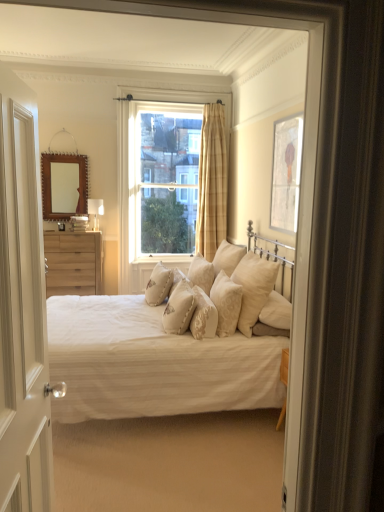
What do you see at coordinates (226, 303) in the screenshot? I see `creamy satin pillow at center, the 2th pillow positioned from the right` at bounding box center [226, 303].

Where is `clear glass window at center`? This screenshot has width=384, height=512. clear glass window at center is located at coordinates (168, 182).

Locate an element on the screen. The image size is (384, 512). wooden-framed mirror at upper left is located at coordinates (64, 185).

At what (x,y) coordinates should I click in order to perform the action: click on creamy satin pillow at center, which ranks as the fourth pillow in left-to-right order. Please return your answer as a coordinate pair (x, y). This screenshot has width=384, height=512. Looking at the image, I should click on tap(203, 316).

Is point (62, 211) closer to viewer compared to point (88, 251)?

No, it is not.

Is wooden-framed mirror at upper left turned away from natural wood chest of drawers at left?

wooden-framed mirror at upper left is not turned away from natural wood chest of drawers at left.

Who is shorter, wooden-framed mirror at upper left or natural wood chest of drawers at left?

With less height is natural wood chest of drawers at left.

Where is `mirror located behind the natural wood chest of drawers at left`? mirror located behind the natural wood chest of drawers at left is located at coordinates (64, 185).

Does wooden-framed mirror at upper left turn towards beige textured pillow at center, which is the 6th pillow from right to left?

No, wooden-framed mirror at upper left is not facing towards beige textured pillow at center, which is the 6th pillow from right to left.

Is point (52, 214) behind point (173, 270)?

That is True.

Consider the image. How distant is wooden-framed mirror at upper left from beige textured pillow at center, marked as the second pillow in a left-to-right arrangement?

The distance of wooden-framed mirror at upper left from beige textured pillow at center, marked as the second pillow in a left-to-right arrangement, is 6.78 feet.

From the image's perspective, which is above, wooden-framed mirror at upper left or beige textured pillow at center, marked as the second pillow in a left-to-right arrangement?

wooden-framed mirror at upper left.

Who is smaller, natural wood chest of drawers at left or wooden-framed mirror at upper left?

Smaller between the two is wooden-framed mirror at upper left.

Is natural wood chest of drawers at left taller or shorter than wooden-framed mirror at upper left?

natural wood chest of drawers at left is shorter than wooden-framed mirror at upper left.

From a real-world perspective, who is located higher, natural wood chest of drawers at left or wooden-framed mirror at upper left?

From a 3D spatial view, wooden-framed mirror at upper left is above.

Which of these two, creamy satin pillow at center, which is the 6th pillow from left to right, or beige textured pillow at center, which is the 6th pillow from right to left, stands shorter?

Standing shorter between the two is beige textured pillow at center, which is the 6th pillow from right to left.

Does creamy satin pillow at center, the 2th pillow positioned from the right, touch beige textured pillow at center, which is the 6th pillow from right to left?

No, creamy satin pillow at center, the 2th pillow positioned from the right, is not making contact with beige textured pillow at center, which is the 6th pillow from right to left.

Locate an element on the screen. the 4th pillow located above the beige textured pillow at center, marked as the second pillow in a left-to-right arrangement (from a real-world perspective) is located at coordinates (226, 303).

Is creamy satin pillow at center, the 2th pillow positioned from the right, positioned behind beige textured pillow at center, which is the 6th pillow from right to left?

That is False.

From a real-world perspective, is matte white bed at center above or below matte silver picture frame at upper right?

matte white bed at center is situated lower than matte silver picture frame at upper right in the real world.

Consider the image. Considering the relative sizes of matte white bed at center and matte silver picture frame at upper right in the image provided, is matte white bed at center thinner than matte silver picture frame at upper right?

Incorrect, the width of matte white bed at center is not less than that of matte silver picture frame at upper right.

Is matte white bed at center not within matte silver picture frame at upper right?

Indeed, matte white bed at center is completely outside matte silver picture frame at upper right.

In the scene shown: Which object is closer to the camera, matte white lampshade at center or matte silver picture frame at upper right?

matte silver picture frame at upper right is more forward.

Which is correct: matte white lampshade at center is inside matte silver picture frame at upper right, or outside of it?

matte white lampshade at center is outside matte silver picture frame at upper right.

Is matte white lampshade at center shorter than matte silver picture frame at upper right?

Yes, matte white lampshade at center is shorter than matte silver picture frame at upper right.

Considering the relative sizes of matte white bed at center and clear glass window at center in the image provided, is matte white bed at center shorter than clear glass window at center?

Yes, matte white bed at center is shorter than clear glass window at center.

Is point (159, 329) closer or farther from the camera than point (194, 179)?

Point (159, 329) appears to be closer to the viewer than point (194, 179).

Which of these two, matte white bed at center or clear glass window at center, is smaller?

clear glass window at center is smaller.

The image size is (384, 512). Find the location of `the chest of drawers that is in front of the wooden-framed mirror at upper left`. the chest of drawers that is in front of the wooden-framed mirror at upper left is located at coordinates (73, 263).

Where is `mirror above the beige textured pillow at center, marked as the second pillow in a left-to-right arrangement (from a real-world perspective)`? mirror above the beige textured pillow at center, marked as the second pillow in a left-to-right arrangement (from a real-world perspective) is located at coordinates (64, 185).

Which object lies nearer to the anchor point beige textured pillow at center, which is the 1th pillow in left-to-right order, creamy satin pillow at center, which ranks as the fourth pillow in left-to-right order, or beige fabric pillow at center, placed as the first pillow when sorted from right to left?

creamy satin pillow at center, which ranks as the fourth pillow in left-to-right order, lies closer to beige textured pillow at center, which is the 1th pillow in left-to-right order, than the other object.

From the image, which object appears to be nearer to matte silver picture frame at upper right, matte white lampshade at center or white wooden door at left?

Among the two, matte white lampshade at center is located nearer to matte silver picture frame at upper right.

Based on the photo, looking at the image, which one is located closer to creamy satin pillow at center, which is the 6th pillow from left to right, white wooden door at left or matte white bed at center?

matte white bed at center is positioned closer to the anchor creamy satin pillow at center, which is the 6th pillow from left to right.

Considering their positions, is beige textured pillow at center, arranged as the fifth pillow when viewed from the left, positioned closer to beige textured pillow at center, which is the 1th pillow in left-to-right order, than matte silver picture frame at upper right?

beige textured pillow at center, arranged as the fifth pillow when viewed from the left.

Estimate the real-world distances between objects in this image. Which object is closer to creamy satin pillow at center, which is the 6th pillow from left to right, creamy satin pillow at center, arranged as the fourth pillow when viewed from the right, or beige textured pillow at center, the 3th pillow from the left?

The object closer to creamy satin pillow at center, which is the 6th pillow from left to right, is creamy satin pillow at center, arranged as the fourth pillow when viewed from the right.

Which object lies further to the anchor point beige textured pillow at center, the 5th pillow in the right-to-left sequence, creamy satin pillow at center, which ranks as the fourth pillow in left-to-right order, or beige textured pillow at center, which ranks as the seventh pillow in right-to-left order?

Among the two, beige textured pillow at center, which ranks as the seventh pillow in right-to-left order, is located further to beige textured pillow at center, the 5th pillow in the right-to-left sequence.

Considering their positions, is matte white lampshade at center positioned closer to beige fabric pillow at center, placed as the first pillow when sorted from right to left, than matte white bed at center?

matte white bed at center.

From the image, which object appears to be nearer to beige fabric pillow at center, placed as the first pillow when sorted from right to left, clear glass window at center or wooden-framed mirror at upper left?

Based on the image, clear glass window at center appears to be nearer to beige fabric pillow at center, placed as the first pillow when sorted from right to left.

The width and height of the screenshot is (384, 512). I want to click on picture frame between beige textured pillow at center, the 5th pillow in the right-to-left sequence, and matte white lampshade at center, along the z-axis, so click(x=286, y=173).

The height and width of the screenshot is (512, 384). Identify the location of picture frame located between creamy satin pillow at center, which is the 6th pillow from left to right, and matte white lampshade at center in the depth direction. (286, 173).

The image size is (384, 512). In order to click on curtain between matte silver picture frame at upper right and clear glass window at center along the z-axis in this screenshot , I will do `click(212, 182)`.

At what (x,y) coordinates should I click in order to perform the action: click on window screen between natural wood chest of drawers at left and beige textured pillow at center, arranged as the fifth pillow when viewed from the left. Please return your answer as a coordinate pair (x, y). This screenshot has width=384, height=512. Looking at the image, I should click on (168, 182).